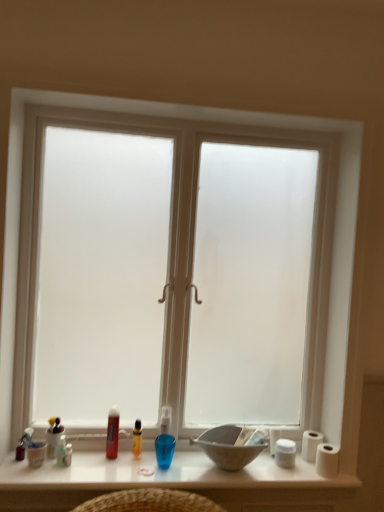
Locate an element on the screen. vacant area located to the right-hand side of translucent plastic bottle at center, marked as the fifth toiletry in a left-to-right arrangement is located at coordinates [x=162, y=468].